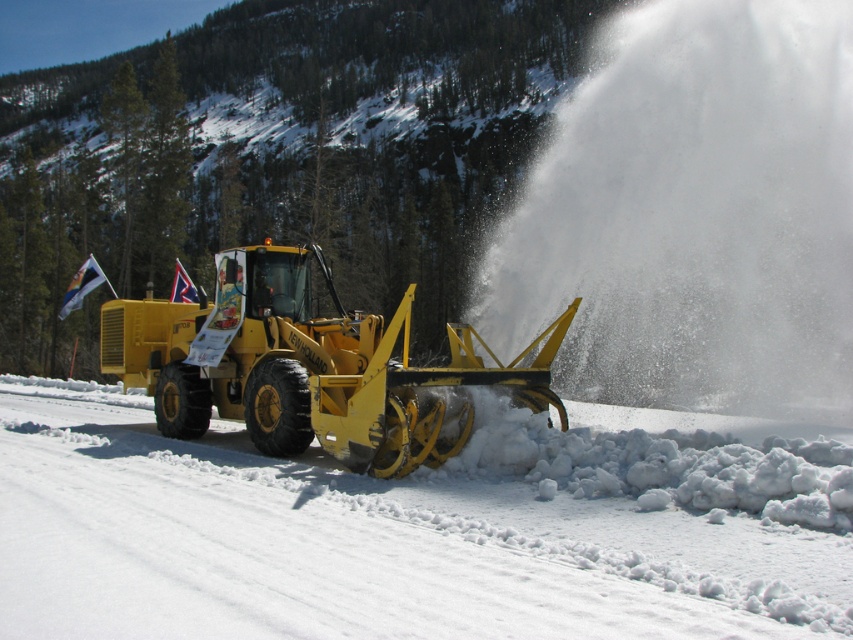
Question: Which of the following is the closest to the observer?

Choices:
 (A) tap(393, 348)
 (B) tap(585, 525)

Answer: (B)

Question: Is yellow rubber snowplow at center further to camera compared to yellow metallic snowplow at center?

Choices:
 (A) no
 (B) yes

Answer: (A)

Question: Does yellow rubber snowplow at center appear on the left side of yellow metallic snowplow at center?

Choices:
 (A) yes
 (B) no

Answer: (B)

Question: Is yellow rubber snowplow at center thinner than yellow metallic snowplow at center?

Choices:
 (A) yes
 (B) no

Answer: (B)

Question: Which point is closer to the camera taking this photo?

Choices:
 (A) (73, 531)
 (B) (265, 310)

Answer: (A)

Question: Which object appears closest to the camera in this image?

Choices:
 (A) yellow rubber snowplow at center
 (B) yellow metallic snowplow at center

Answer: (A)